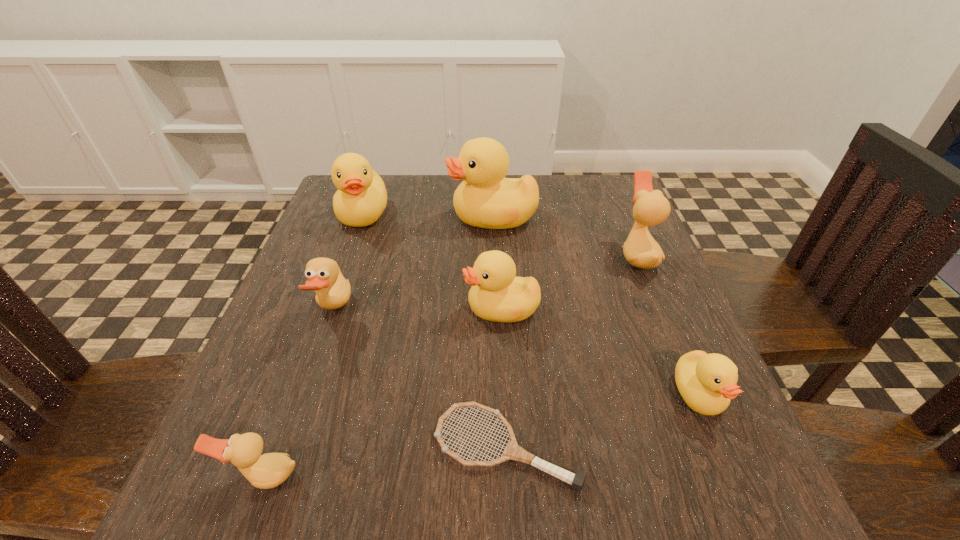
Where is `free spot that satisfies the following two spatial constraints: 1. on the back side of the gray tennis racket; 2. at the beak of the biggest yellow duck`? The height and width of the screenshot is (540, 960). free spot that satisfies the following two spatial constraints: 1. on the back side of the gray tennis racket; 2. at the beak of the biggest yellow duck is located at coordinates (495, 217).

Identify the location of vacant space that satisfies the following two spatial constraints: 1. at the beak of the tallest duck; 2. on the back side of the tennis racket. (501, 448).

I want to click on vacant position in the image that satisfies the following two spatial constraints: 1. at the beak of the third farthest yellow duck; 2. on the front side of the gray tennis racket, so click(508, 448).

Image resolution: width=960 pixels, height=540 pixels. Find the location of `free location that satisfies the following two spatial constraints: 1. on the beak of the tennis racket; 2. on the right side of the second farthest tan duck`. free location that satisfies the following two spatial constraints: 1. on the beak of the tennis racket; 2. on the right side of the second farthest tan duck is located at coordinates (287, 448).